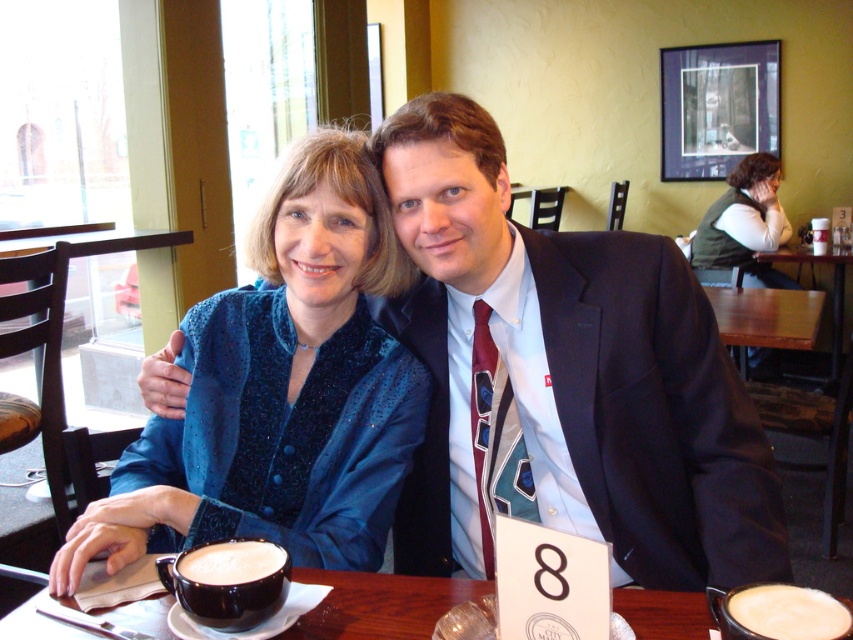
You are a waiter in this scene. You need to deliver a dessert menu to the person wearing the green textured vest at upper right. Which direction should you approach from relative to the white frothy beverage at lower left?

You should approach from the right side of the white frothy beverage at lower left because the green textured vest at upper right is located to the right of it.